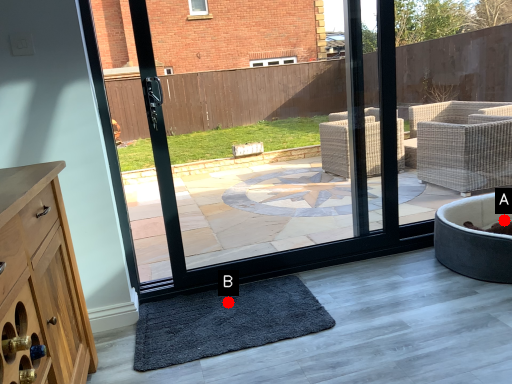
Question: Two points are circled on the image, labeled by A and B beside each circle. Which point appears farthest from the camera in this image?

Choices:
 (A) A is further
 (B) B is further

Answer: (A)